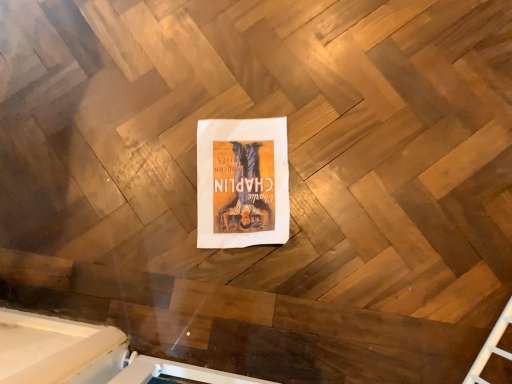
Where is `free space behind white paper poster at center`? This screenshot has height=384, width=512. free space behind white paper poster at center is located at coordinates (220, 78).